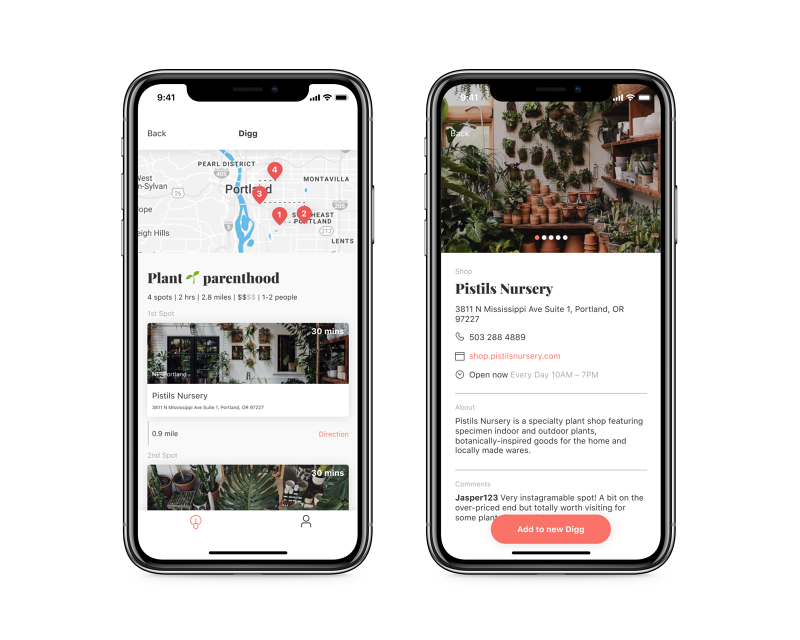
The image size is (800, 640). In order to click on phone 1 in this screenshot , I will do `click(254, 278)`.